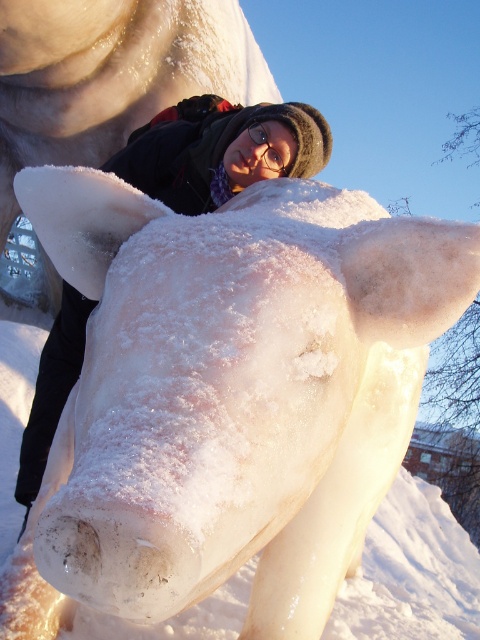
In the scene shown: Can you confirm if icy white sculpture at center is shorter than transparent plastic goggles at center?

No, icy white sculpture at center is not shorter than transparent plastic goggles at center.

Does point (299, 192) come behind point (279, 161)?

No.

This screenshot has height=640, width=480. Identify the location of icy white sculpture at center. (228, 394).

Can you confirm if icy white sculpture at center is shorter than matte black jacket at center?

No.

Does icy white sculpture at center come behind matte black jacket at center?

No.

Is point (346, 502) farther from camera compared to point (82, 358)?

No, (346, 502) is in front of (82, 358).

This screenshot has height=640, width=480. What are the coordinates of `icy white sculpture at center` in the screenshot? It's located at (228, 394).

Can you confirm if matte black jacket at center is shorter than transparent plastic goggles at center?

In fact, matte black jacket at center may be taller than transparent plastic goggles at center.

Between matte black jacket at center and transparent plastic goggles at center, which one is positioned higher?

matte black jacket at center is above.

I want to click on matte black jacket at center, so click(217, 150).

This screenshot has width=480, height=640. Find the location of `matte black jacket at center`. matte black jacket at center is located at coordinates (217, 150).